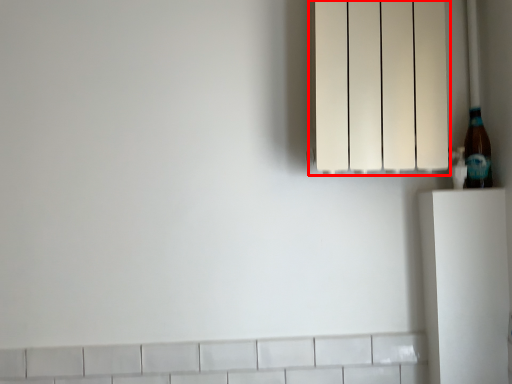
Question: From the image's perspective, what is the correct spatial positioning of lamp (annotated by the red box) in reference to bottle?

Choices:
 (A) below
 (B) above

Answer: (B)